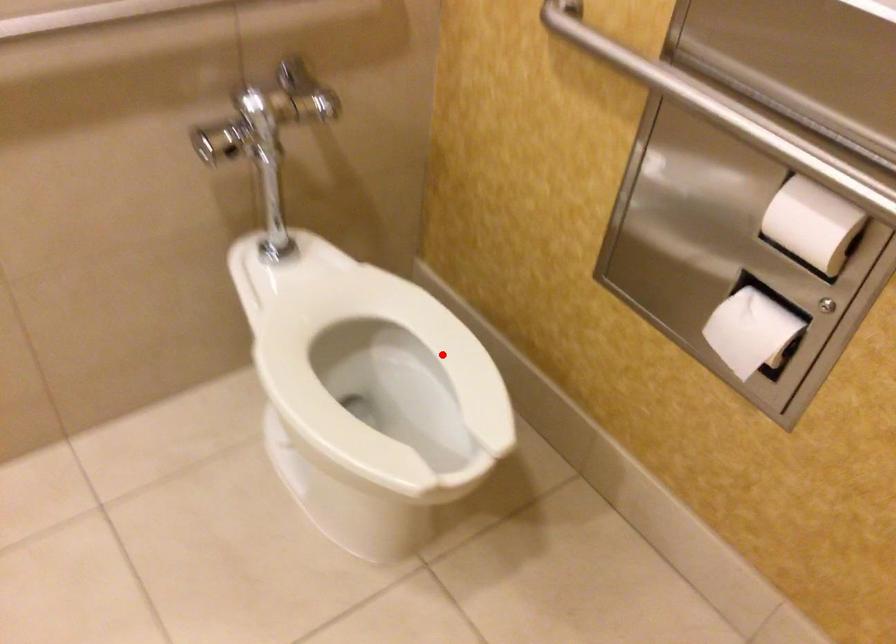
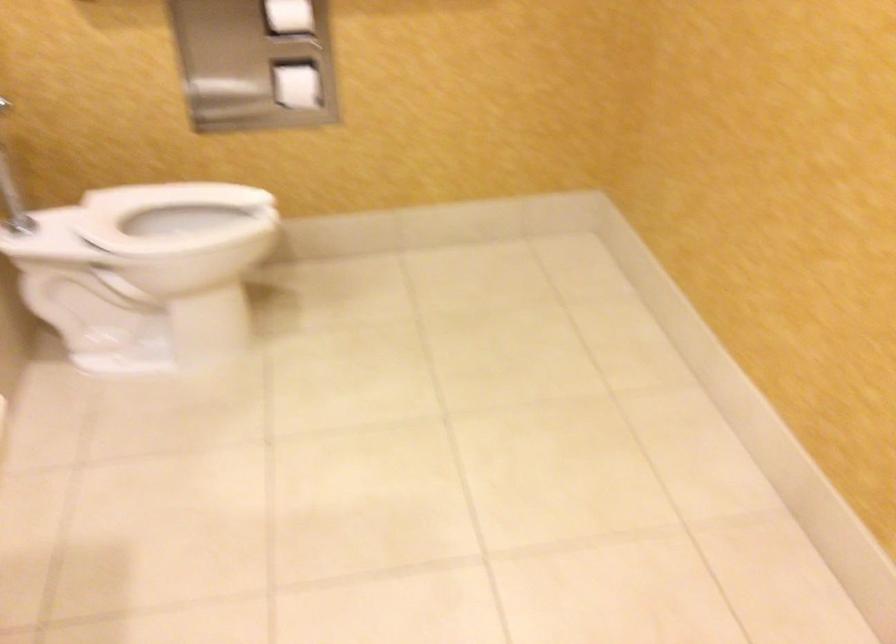
Find the pixel in the second image that matches the highlighted location in the first image.

(174, 216)